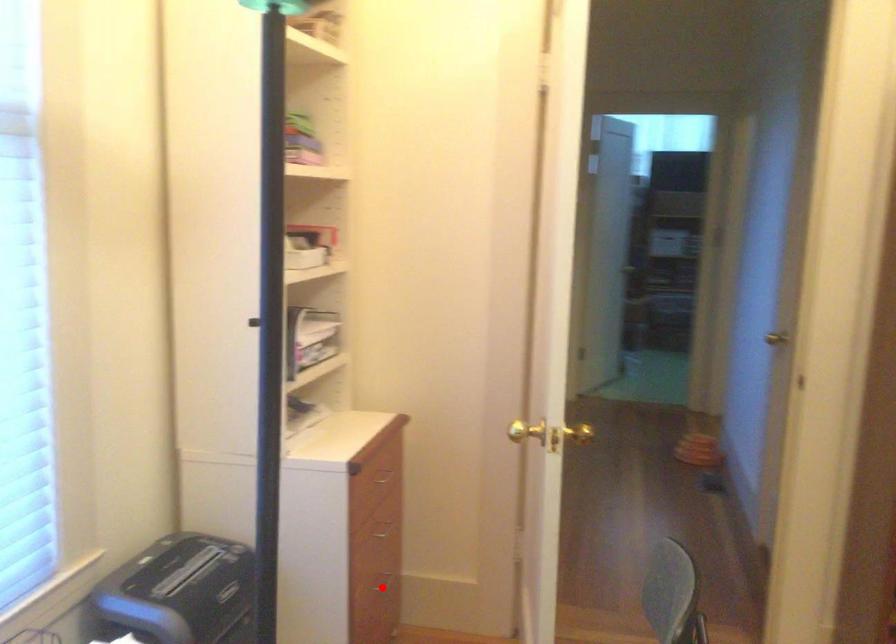
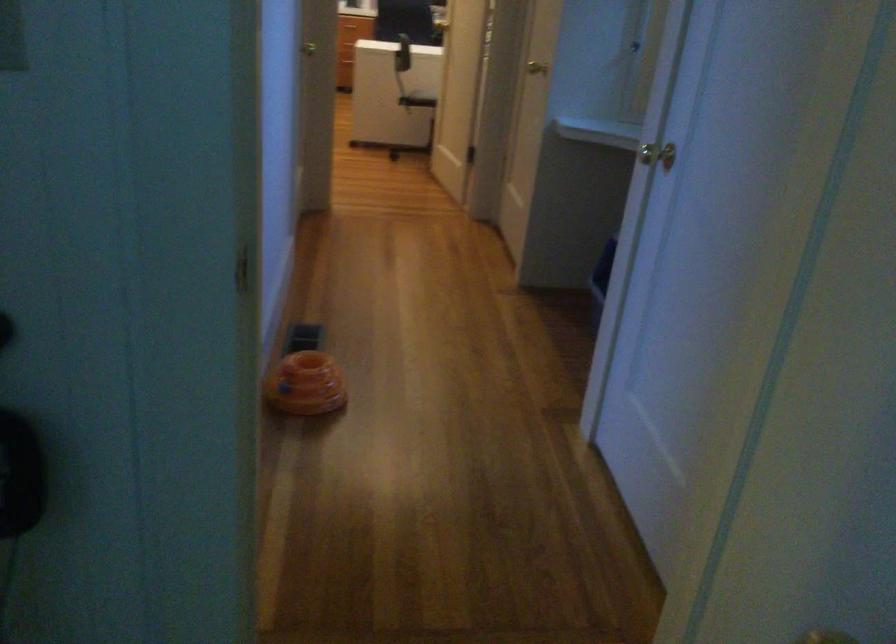
Question: I am providing you with two images of the same scene from different viewpoints. A red point is marked on the first image. Is the red point's position out of view in image 2?

Choices:
 (A) Yes
 (B) No

Answer: (A)